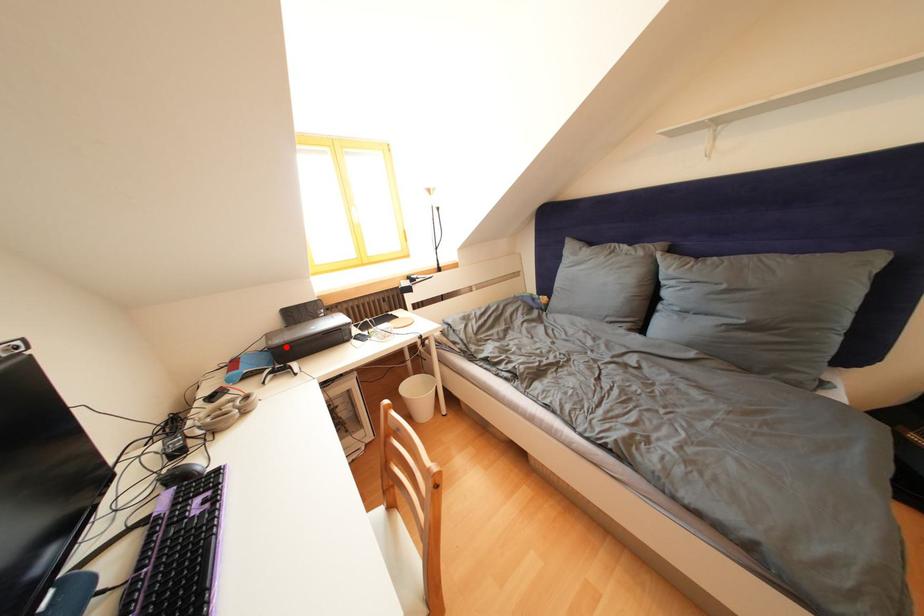
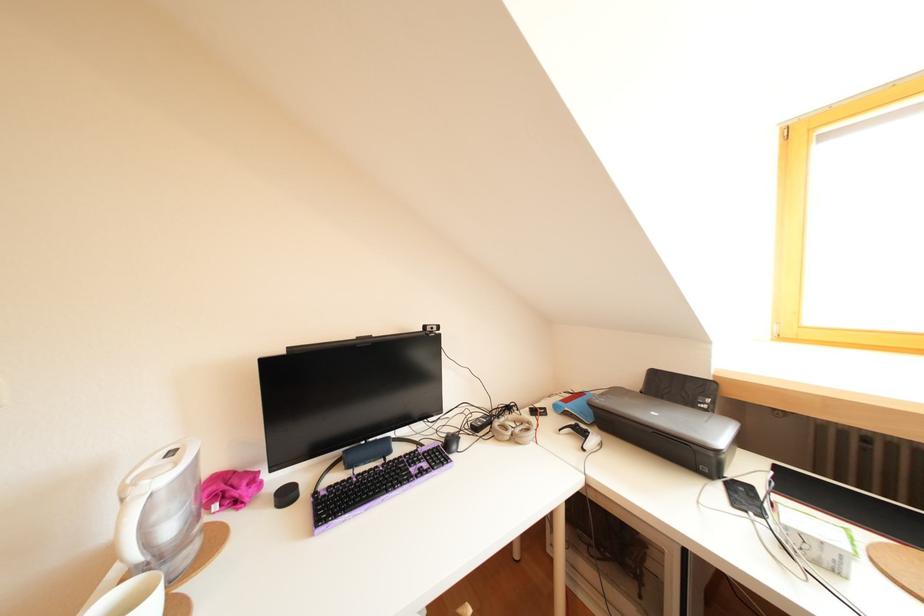
Question: I am providing you with two images of the same scene from different viewpoints. In image1, a red point is highlighted. Considering the same 3D point in image2, which of the following is correct?

Choices:
 (A) It is closer
 (B) It is farther

Answer: (A)